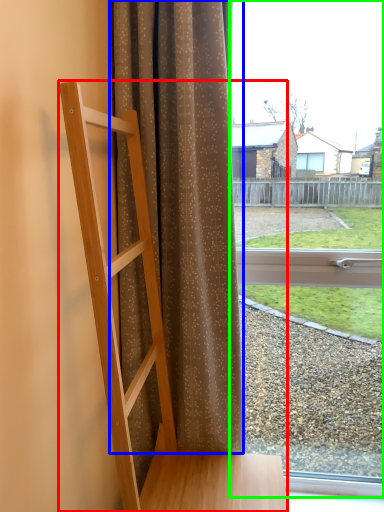
Question: Considering the real-world distances, which object is closest to furniture (highlighted by a red box)? curtain (highlighted by a blue box) or window (highlighted by a green box).

Choices:
 (A) curtain
 (B) window

Answer: (A)